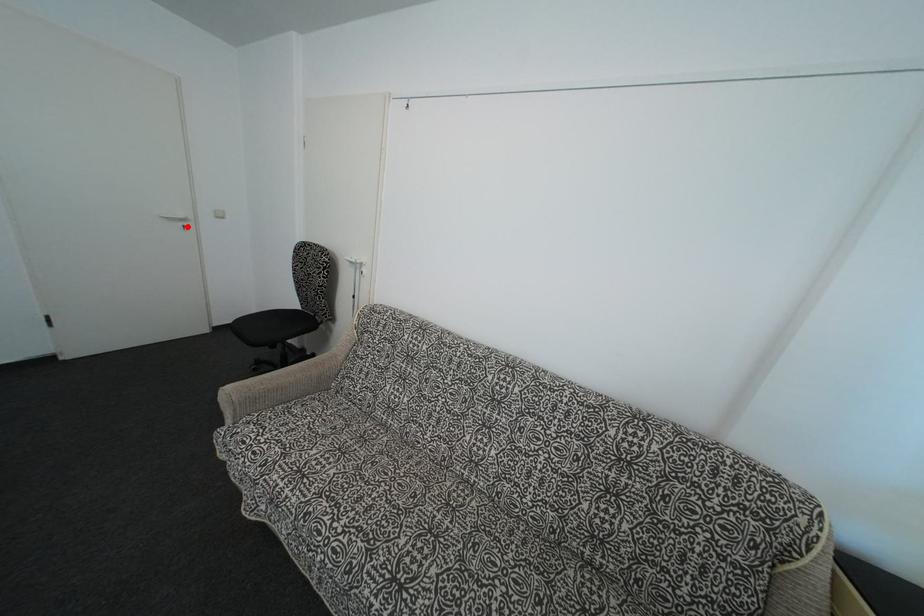
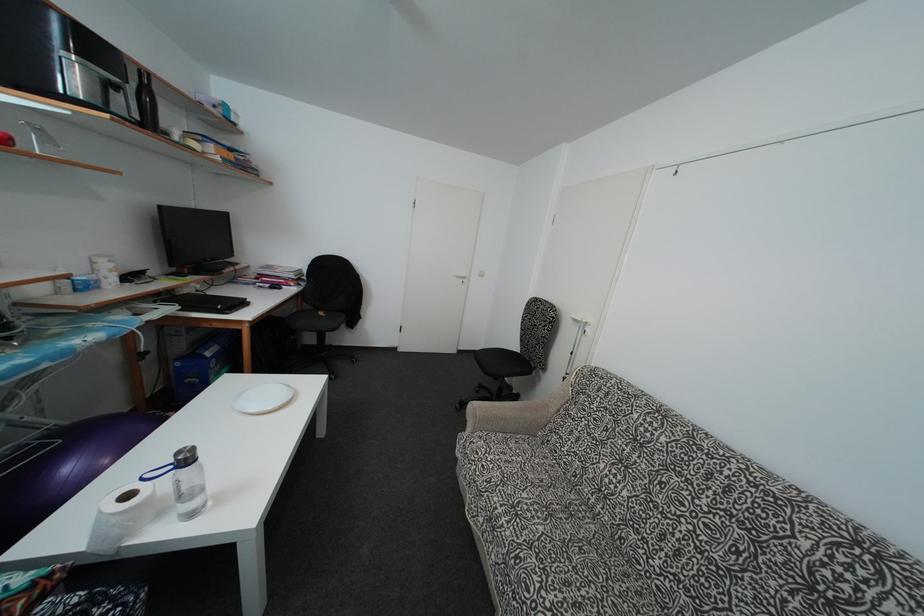
Question: I am providing you with two images of the same scene from different viewpoints. Image1 has a red point marked. In image2, the corresponding 3D location appears at what relative position? Reply with the corresponding letter.

Choices:
 (A) Closer
 (B) Farther

Answer: (A)